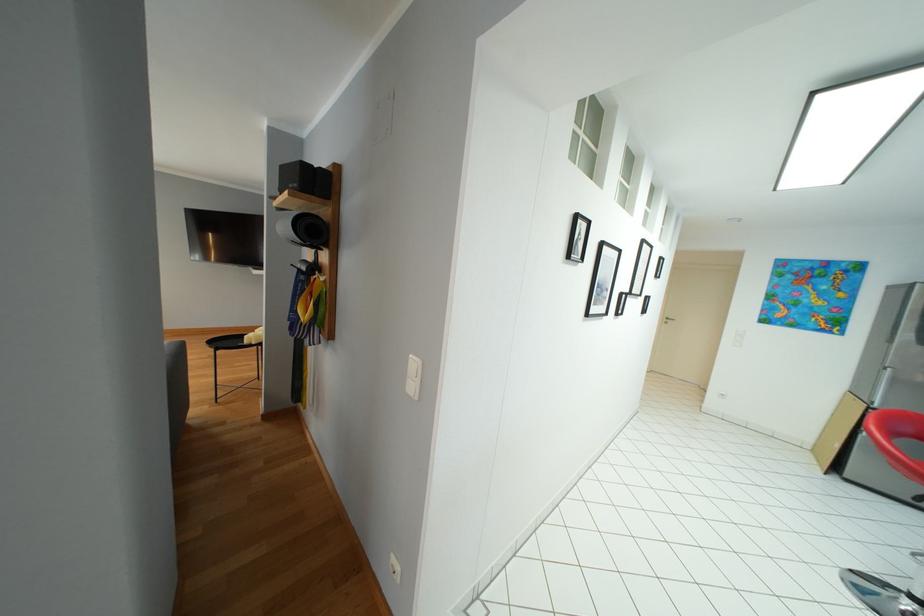
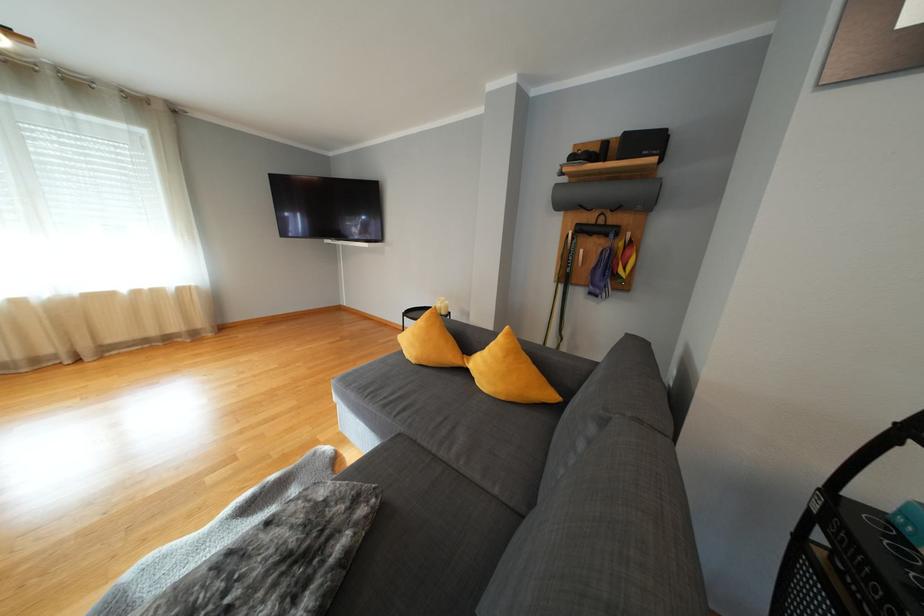
Question: What movement of the cameraman would produce the second image?

Choices:
 (A) Left
 (B) Right
 (C) Forward
 (D) Backward

Answer: (A)